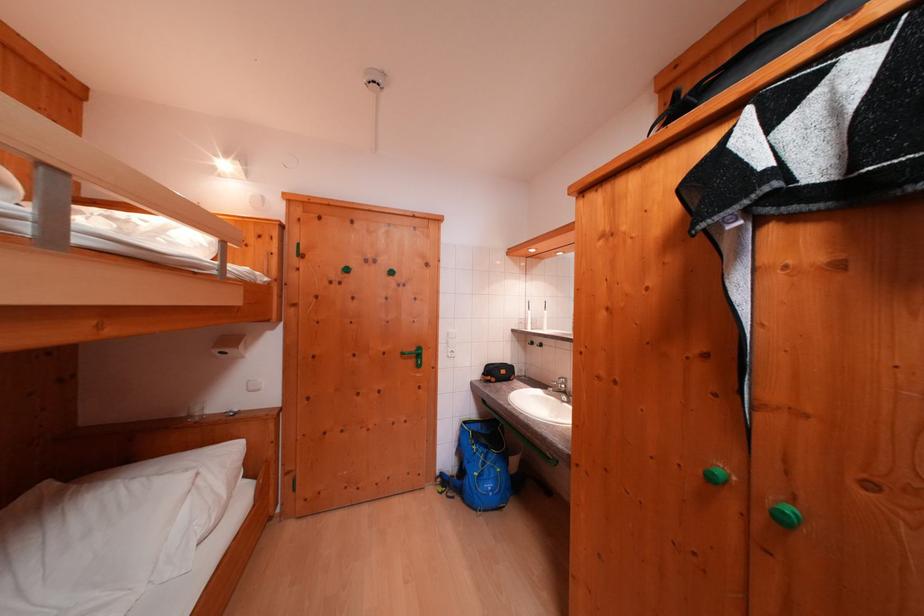
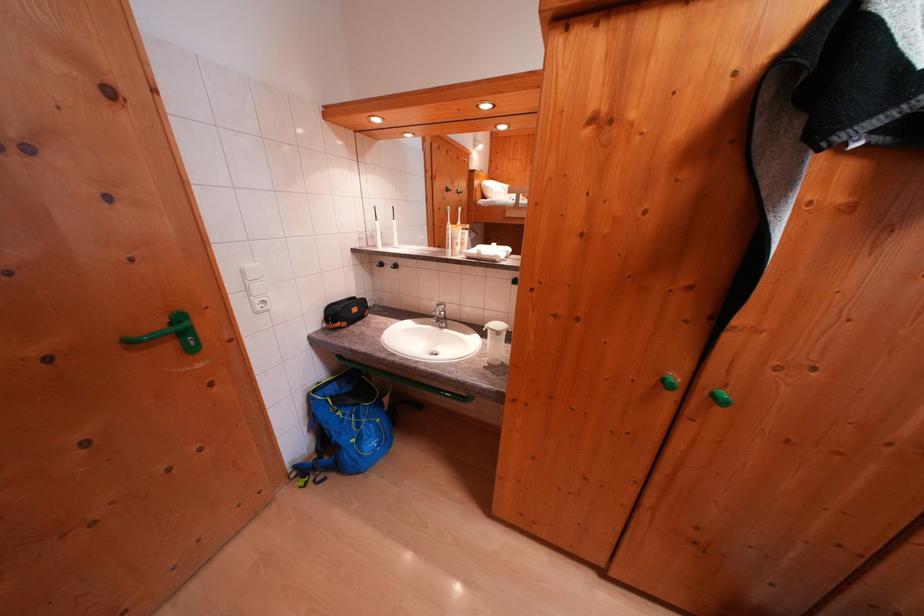
First-person continuous shooting, in which direction is the camera rotating?

The camera's rotation is toward right-down.